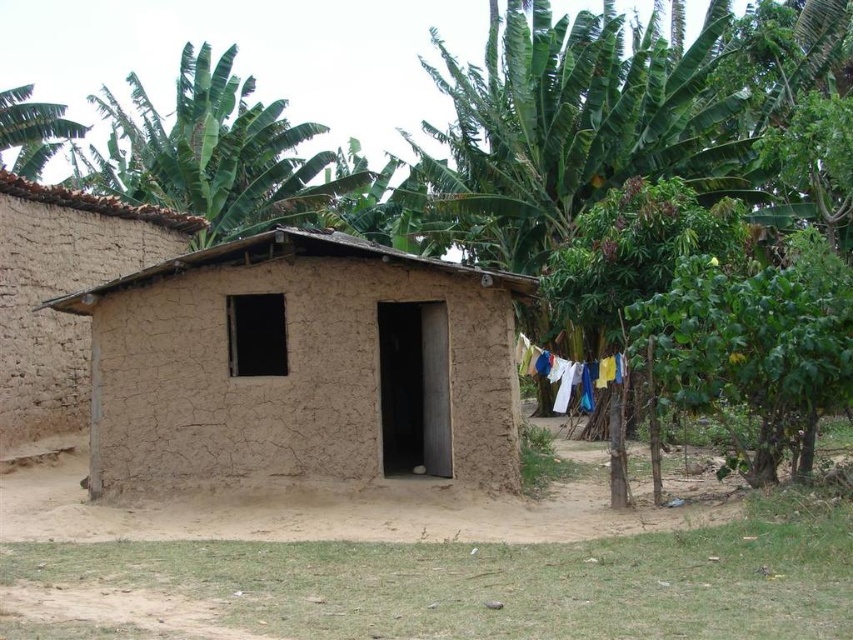
Looking at this image, you are a drone operator tasked with capturing aerial footage of the green leafy banana tree at upper left and the white fabric at center. Your drone has a maximum flight range of 20 meters. Can you fly the drone from the banana tree to the white fabric without exceeding its range?

The distance between the green leafy banana tree at upper left and the white fabric at center is 20.75 meters, which exceeds the drone maximum flight range of 20 meters. Therefore, the drone cannot fly from the banana tree to the white fabric without exceeding its range.

You are standing outside the rustic mud brick house and notice the green leafy banana tree at upper left and the white fabric at center. Which object is higher in the image?

The green leafy banana tree at upper left is above the white fabric at center, so it is higher in the image.